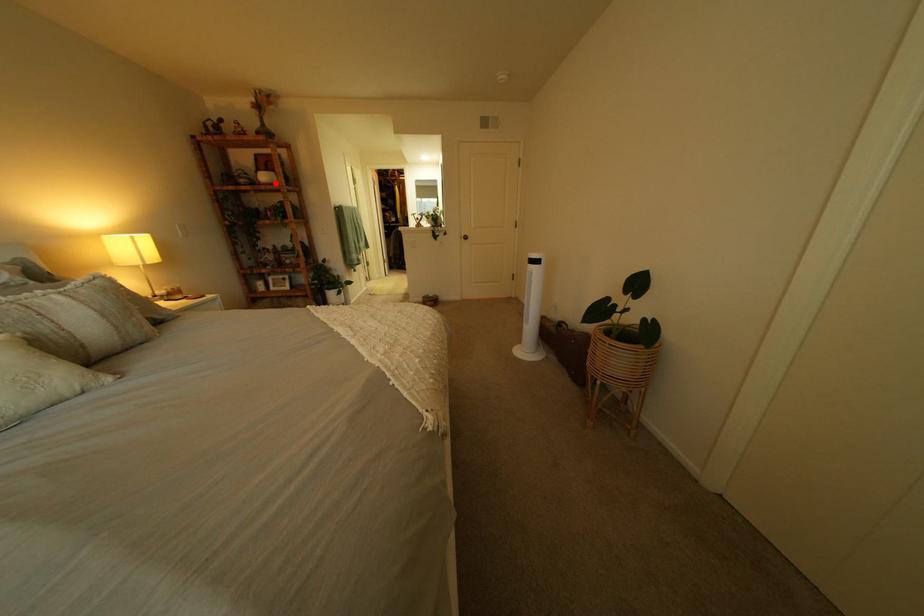
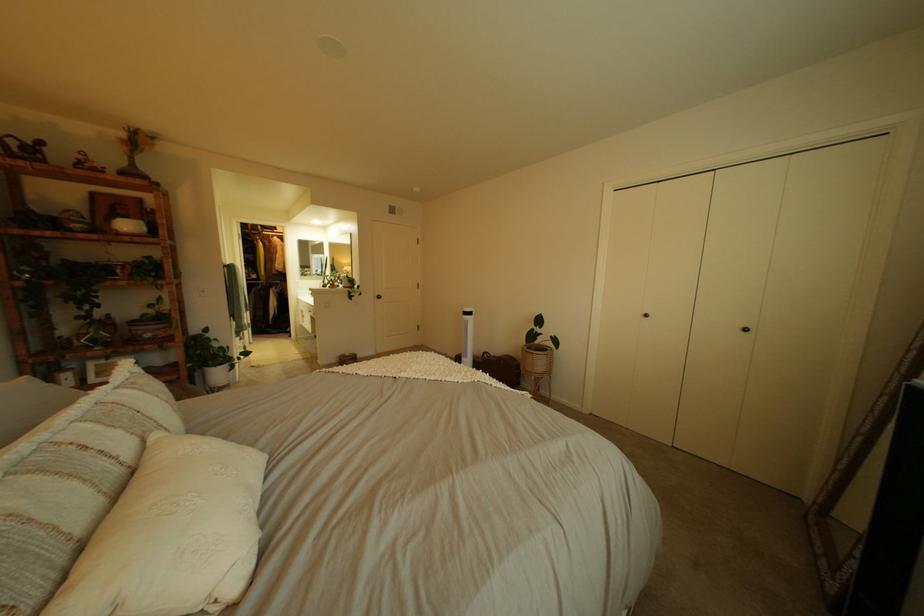
Where in the second image is the point corresponding to the highlighted location from the first image?

(132, 232)